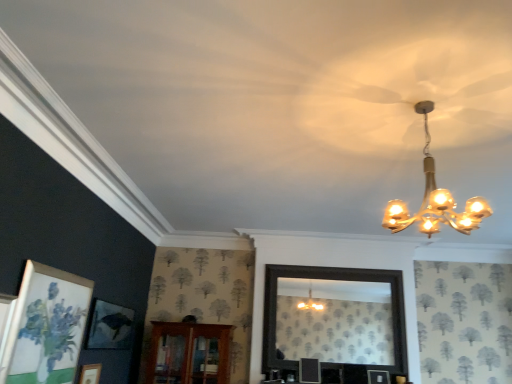
Question: Is gold glass chandelier at upper right outside matte white picture frame at lower left?

Choices:
 (A) yes
 (B) no

Answer: (A)

Question: From a real-world perspective, is gold glass chandelier at upper right located higher than matte white picture frame at lower left?

Choices:
 (A) no
 (B) yes

Answer: (B)

Question: Considering the relative sizes of gold glass chandelier at upper right and matte white picture frame at lower left in the image provided, is gold glass chandelier at upper right thinner than matte white picture frame at lower left?

Choices:
 (A) no
 (B) yes

Answer: (A)

Question: Does gold glass chandelier at upper right appear on the left side of matte white picture frame at lower left?

Choices:
 (A) no
 (B) yes

Answer: (A)

Question: Is gold glass chandelier at upper right smaller than matte white picture frame at lower left?

Choices:
 (A) yes
 (B) no

Answer: (B)

Question: Considering the relative positions of brown wooden cabinet at center and matte white picture frame at lower left in the image provided, is brown wooden cabinet at center to the left or to the right of matte white picture frame at lower left?

Choices:
 (A) right
 (B) left

Answer: (A)

Question: In terms of size, does brown wooden cabinet at center appear bigger or smaller than matte white picture frame at lower left?

Choices:
 (A) big
 (B) small

Answer: (A)

Question: Do you think brown wooden cabinet at center is within matte white picture frame at lower left, or outside of it?

Choices:
 (A) outside
 (B) inside

Answer: (A)

Question: From the image's perspective, relative to matte white picture frame at lower left, is brown wooden cabinet at center above or below?

Choices:
 (A) below
 (B) above

Answer: (A)

Question: Considering their positions, is gold glass chandelier at upper right located in front of or behind matte white picture frame at lower left?

Choices:
 (A) front
 (B) behind

Answer: (A)

Question: Looking at the image, does gold glass chandelier at upper right seem bigger or smaller compared to matte white picture frame at lower left?

Choices:
 (A) small
 (B) big

Answer: (B)

Question: From their relative heights in the image, would you say gold glass chandelier at upper right is taller or shorter than matte white picture frame at lower left?

Choices:
 (A) short
 (B) tall

Answer: (B)

Question: Based on their positions, is gold glass chandelier at upper right located to the left or right of matte white picture frame at lower left?

Choices:
 (A) left
 (B) right

Answer: (B)

Question: From a real-world perspective, is matte white picture frame at lower left positioned above or below brown wooden cabinet at center?

Choices:
 (A) above
 (B) below

Answer: (B)

Question: Considering the positions of matte white picture frame at lower left and brown wooden cabinet at center in the image, is matte white picture frame at lower left wider or thinner than brown wooden cabinet at center?

Choices:
 (A) wide
 (B) thin

Answer: (B)